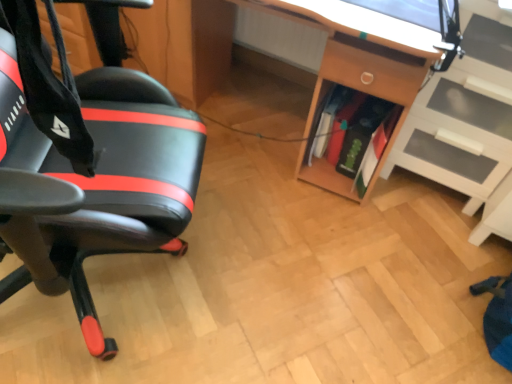
Question: Is green matte book at center, acting as the first book starting from the front, positioned in front of green matte book at center, which ranks as the 2th book in back-to-front order?

Choices:
 (A) no
 (B) yes

Answer: (B)

Question: Does green matte book at center, the 3th book from the back, have a larger size compared to green matte book at center, which ranks as the 2th book in back-to-front order?

Choices:
 (A) no
 (B) yes

Answer: (A)

Question: Is green matte book at center, the 3th book from the back, to the right of green matte book at center, which is the second book in front-to-back order, from the viewer's perspective?

Choices:
 (A) no
 (B) yes

Answer: (B)

Question: Is green matte book at center, acting as the first book starting from the front, facing away from green matte book at center, which ranks as the 2th book in back-to-front order?

Choices:
 (A) no
 (B) yes

Answer: (A)

Question: Can we say green matte book at center, acting as the first book starting from the front, lies outside green matte book at center, which ranks as the 2th book in back-to-front order?

Choices:
 (A) no
 (B) yes

Answer: (B)

Question: Is wooden desk at center wider or thinner than green matte book at center, acting as the first book starting from the front?

Choices:
 (A) wide
 (B) thin

Answer: (A)

Question: From the image's perspective, is wooden desk at center located above or below green matte book at center, acting as the first book starting from the front?

Choices:
 (A) above
 (B) below

Answer: (A)

Question: Is wooden desk at center inside the boundaries of green matte book at center, the 3th book from the back, or outside?

Choices:
 (A) outside
 (B) inside

Answer: (A)

Question: Is point (401, 64) closer or farther from the camera than point (355, 180)?

Choices:
 (A) closer
 (B) farther

Answer: (A)

Question: Looking at their shapes, would you say black leather chair at left is wider or thinner than wooden desk at center?

Choices:
 (A) wide
 (B) thin

Answer: (A)

Question: Considering the positions of point (152, 185) and point (357, 74), is point (152, 185) closer or farther from the camera than point (357, 74)?

Choices:
 (A) closer
 (B) farther

Answer: (A)

Question: From a real-world perspective, relative to wooden desk at center, is black leather chair at left vertically above or below?

Choices:
 (A) above
 (B) below

Answer: (A)

Question: From the image's perspective, is black leather chair at left positioned above or below wooden desk at center?

Choices:
 (A) above
 (B) below

Answer: (B)

Question: Which is correct: black leather chair at left is inside green matte book at center, the 3th book from the back, or outside of it?

Choices:
 (A) outside
 (B) inside

Answer: (A)

Question: Is black leather chair at left taller or shorter than green matte book at center, acting as the first book starting from the front?

Choices:
 (A) short
 (B) tall

Answer: (B)